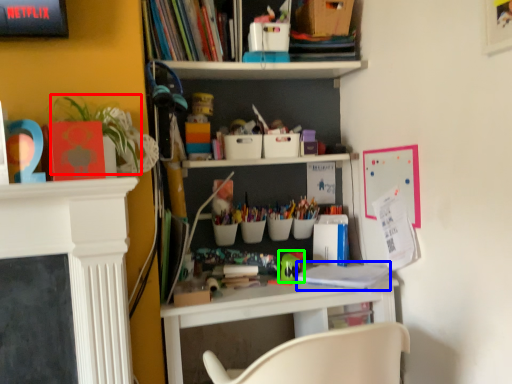
Question: Which object is positioned closest to plant (highlighted by a red box)? Select from book (highlighted by a blue box) and toy (highlighted by a green box).

Choices:
 (A) book
 (B) toy

Answer: (B)